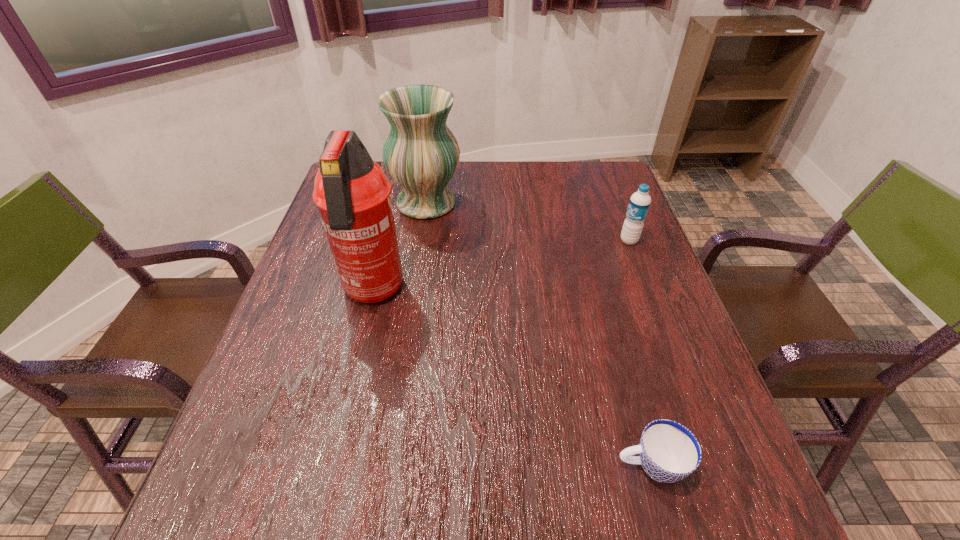
In order to click on vacant space that satisfies the following two spatial constraints: 1. on the label of the second shortest object; 2. on the trigger side of the third farthest object in this screenshot , I will do `click(649, 292)`.